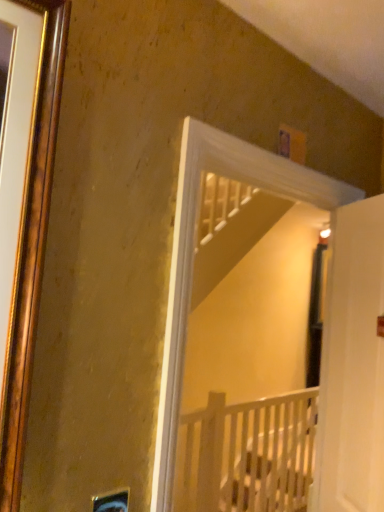
Question: In terms of size, does white matte door at right appear bigger or smaller than white wooden crib at center?

Choices:
 (A) big
 (B) small

Answer: (B)

Question: Which is correct: white matte door at right is inside white wooden crib at center, or outside of it?

Choices:
 (A) inside
 (B) outside

Answer: (B)

Question: Is point (367, 404) positioned closer to the camera than point (195, 439)?

Choices:
 (A) farther
 (B) closer

Answer: (B)

Question: From the image's perspective, is white wooden crib at center above or below white matte door at right?

Choices:
 (A) above
 (B) below

Answer: (B)

Question: Considering their positions, is white wooden crib at center located in front of or behind white matte door at right?

Choices:
 (A) behind
 (B) front

Answer: (A)

Question: In terms of size, does white wooden crib at center appear bigger or smaller than white matte door at right?

Choices:
 (A) big
 (B) small

Answer: (A)

Question: Is white wooden crib at center wider or thinner than white matte door at right?

Choices:
 (A) thin
 (B) wide

Answer: (B)